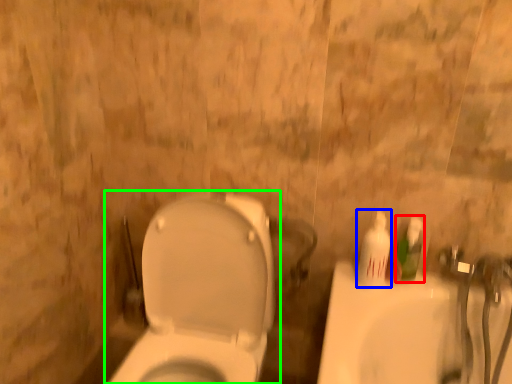
Question: Estimate the real-world distances between objects in this image. Which object is closer to mouthwash (highlighted by a red box), mouthwash (highlighted by a blue box) or toilet (highlighted by a green box)?

Choices:
 (A) mouthwash
 (B) toilet

Answer: (A)